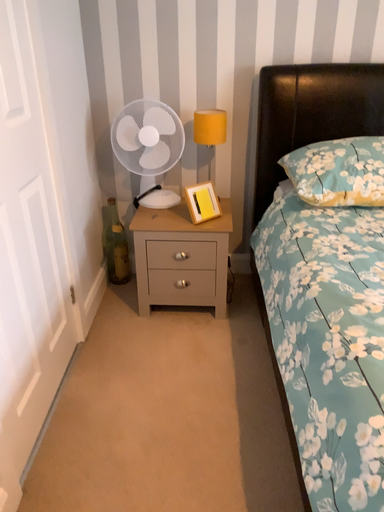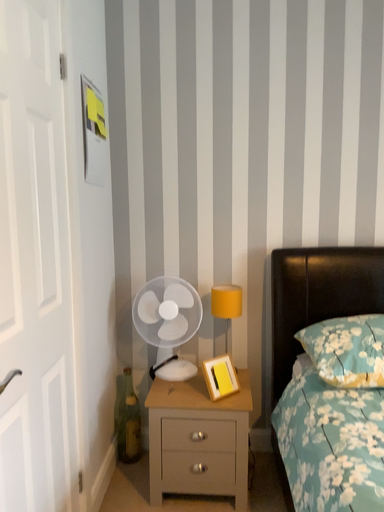
Question: Which way did the camera rotate in the video?

Choices:
 (A) rotated downward
 (B) rotated upward

Answer: (B)